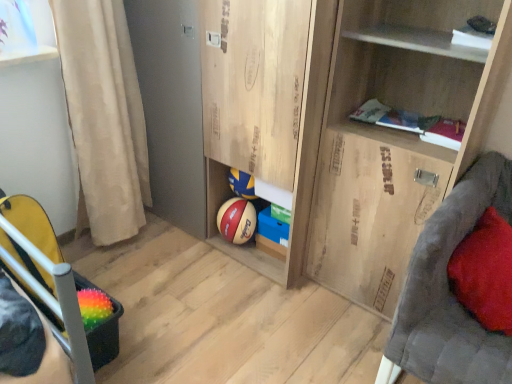
In order to face beige fabric curtain at left, should I rotate leftwards or rightwards?

You should rotate left by 19.285 degrees.

What are the coordinates of `beige fabric curtain at left` in the screenshot? It's located at pos(104,117).

Where is `cupboard that appears below the wooden cabinet at lower center (from the image's perspective)`? cupboard that appears below the wooden cabinet at lower center (from the image's perspective) is located at coordinates (345, 128).

From the image's perspective, is wooden cabinet at lower center located above wooden cupboard at upper right?

Yes, from the image's perspective, wooden cabinet at lower center is on top of wooden cupboard at upper right.

Which of these two, wooden cabinet at lower center or wooden cupboard at upper right, stands shorter?

With less height is wooden cabinet at lower center.

Locate an element on the screen. cabinet behind the wooden cupboard at upper right is located at coordinates (268, 116).

Is wooden cupboard at upper right not inside wooden cabinet at lower center?

Absolutely, wooden cupboard at upper right is external to wooden cabinet at lower center.

Considering the sizes of objects wooden cupboard at upper right and wooden cabinet at lower center in the image provided, who is bigger, wooden cupboard at upper right or wooden cabinet at lower center?

With larger size is wooden cabinet at lower center.

Is wooden cupboard at upper right thinner than wooden cabinet at lower center?

Indeed, wooden cupboard at upper right has a lesser width compared to wooden cabinet at lower center.

Is red velvet pillow at right surrounded by wooden cabinet at lower center?

No, red velvet pillow at right is not a part of wooden cabinet at lower center.

Between wooden cabinet at lower center and red velvet pillow at right, which one appears on the right side from the viewer's perspective?

From the viewer's perspective, red velvet pillow at right appears more on the right side.

Between wooden cabinet at lower center and red velvet pillow at right, which one has larger width?

wooden cabinet at lower center is wider.

Is wooden cabinet at lower center oriented towards red velvet pillow at right?

No, wooden cabinet at lower center is not oriented towards red velvet pillow at right.

Considering their positions, is wooden cupboard at upper right located in front of or behind beige fabric curtain at left?

wooden cupboard at upper right is positioned closer to the viewer than beige fabric curtain at left.

At what (x,y) coordinates should I click in order to perform the action: click on cupboard located on the right of beige fabric curtain at left. Please return your answer as a coordinate pair (x, y). This screenshot has height=384, width=512. Looking at the image, I should click on (345, 128).

Does wooden cupboard at upper right contain beige fabric curtain at left?

No, beige fabric curtain at left is located outside of wooden cupboard at upper right.

From a real-world perspective, is wooden cupboard at upper right physically above beige fabric curtain at left?

Indeed, from a real-world perspective, wooden cupboard at upper right stands above beige fabric curtain at left.

Which of these two, rubber textured basketball at lower left or wooden cupboard at upper right, stands taller?

Standing taller between the two is wooden cupboard at upper right.

Is rubber textured basketball at lower left oriented away from wooden cupboard at upper right?

No, wooden cupboard at upper right is not at the back of rubber textured basketball at lower left.

From a real-world perspective, between rubber textured basketball at lower left and wooden cupboard at upper right, who is vertically lower?

rubber textured basketball at lower left.

Which object is positioned more to the left, red velvet pillow at right or wooden cabinet at lower center?

Positioned to the left is wooden cabinet at lower center.

From a real-world perspective, relative to wooden cabinet at lower center, is red velvet pillow at right vertically above or below?

red velvet pillow at right is below wooden cabinet at lower center.

Image resolution: width=512 pixels, height=384 pixels. I want to click on cabinet on the left of red velvet pillow at right, so click(x=268, y=116).

Is red velvet pillow at right next to wooden cabinet at lower center?

No, red velvet pillow at right is not beside wooden cabinet at lower center.

Consider the image. Considering the relative positions of wooden cabinet at lower center and rubber textured basketball at lower left in the image provided, is wooden cabinet at lower center behind rubber textured basketball at lower left?

No, it is not.

This screenshot has width=512, height=384. In order to click on cabinet located in front of the rubber textured basketball at lower left in this screenshot , I will do `click(268, 116)`.

What's the angular difference between wooden cabinet at lower center and rubber textured basketball at lower left's facing directions?

They differ by 179 degrees in their facing directions.

Is wooden cabinet at lower center taller or shorter than rubber textured basketball at lower left?

Considering their sizes, wooden cabinet at lower center has more height than rubber textured basketball at lower left.

You are a GUI agent. You are given a task and a screenshot of the screen. Output one action in this format:
    pyautogui.click(x=<x>, y=<y>)
    Task: Click on the cabinet located above the wooden cupboard at upper right (from the image's perspective)
    
    Given the screenshot: What is the action you would take?
    pyautogui.click(x=268, y=116)

Locate an element on the screen. cabinet located underneath the wooden cupboard at upper right (from a real-world perspective) is located at coordinates (268, 116).

From the image, which object appears to be farther from red velvet pillow at right, beige fabric curtain at left or rubber textured basketball at lower left?

Based on the image, beige fabric curtain at left appears to be further to red velvet pillow at right.

When comparing their distances from red velvet pillow at right, does rubber textured basketball at lower left or wooden cupboard at upper right seem closer?

wooden cupboard at upper right is closer to red velvet pillow at right.

Based on their spatial positions, is beige fabric curtain at left or wooden cabinet at lower center closer to rubber textured basketball at lower left?

beige fabric curtain at left is closer to rubber textured basketball at lower left.

Considering their positions, is wooden cupboard at upper right positioned closer to beige fabric curtain at left than red velvet pillow at right?

Based on the image, wooden cupboard at upper right appears to be nearer to beige fabric curtain at left.

Estimate the real-world distances between objects in this image. Which object is closer to wooden cabinet at lower center, wooden cupboard at upper right or red velvet pillow at right?

wooden cupboard at upper right is closer to wooden cabinet at lower center.

When comparing their distances from red velvet pillow at right, does rubber textured basketball at lower left or wooden cabinet at lower center seem closer?

The object closer to red velvet pillow at right is wooden cabinet at lower center.

Looking at the image, which one is located closer to rubber textured basketball at lower left, wooden cabinet at lower center or red velvet pillow at right?

The object closer to rubber textured basketball at lower left is wooden cabinet at lower center.

When comparing their distances from red velvet pillow at right, does beige fabric curtain at left or wooden cabinet at lower center seem closer?

Among the two, wooden cabinet at lower center is located nearer to red velvet pillow at right.

Locate an element on the screen. This screenshot has width=512, height=384. cabinet between rubber textured basketball at lower left and red velvet pillow at right in the horizontal direction is located at coordinates [x=268, y=116].

Identify the location of curtain between wooden cabinet at lower center and rubber textured basketball at lower left in the up-down direction. (104, 117).

This screenshot has height=384, width=512. I want to click on cabinet between beige fabric curtain at left and wooden cupboard at upper right, so click(268, 116).

Image resolution: width=512 pixels, height=384 pixels. In order to click on basketball located between beige fabric curtain at left and red velvet pillow at right in the left-right direction in this screenshot , I will do `click(94, 307)`.